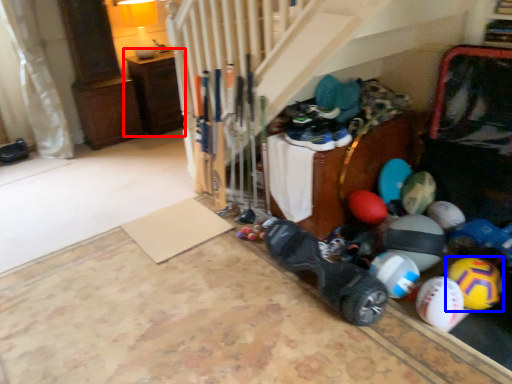
Question: Which of the following is the farthest to the observer, furniture (highlighted by a red box) or beach ball (highlighted by a blue box)?

Choices:
 (A) furniture
 (B) beach ball

Answer: (A)